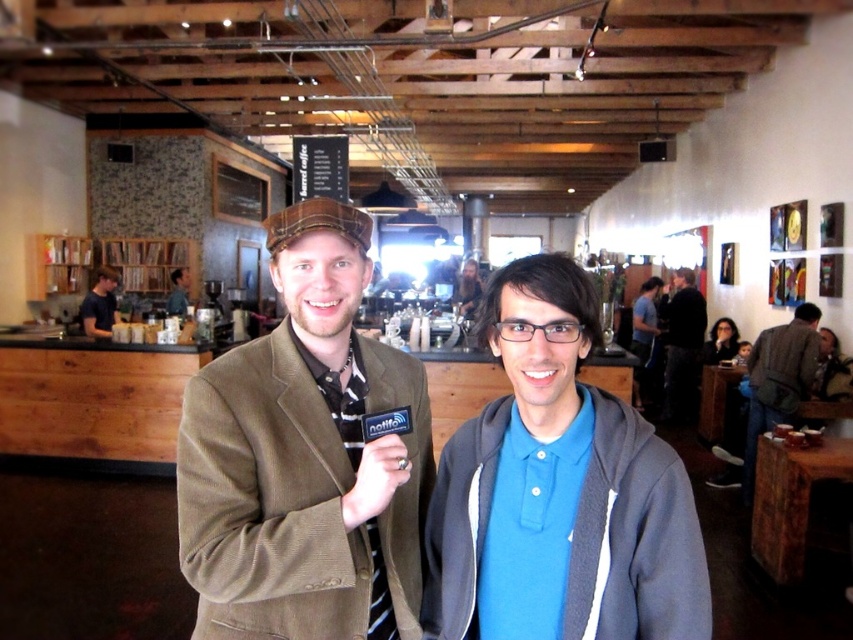
Does brown corduroy jacket at center appear on the right side of matte black hair at upper right?

Incorrect, brown corduroy jacket at center is not on the right side of matte black hair at upper right.

Which is below, brown corduroy jacket at center or matte black hair at upper right?

matte black hair at upper right is below.

Who is more forward, (234, 524) or (711, 358)?

Point (234, 524) is in front.

At what (x,y) coordinates should I click in order to perform the action: click on brown corduroy jacket at center. Please return your answer as a coordinate pair (x, y). The image size is (853, 640). Looking at the image, I should click on point(305,458).

Looking at this image, is blue cotton polo shirt at center smaller than dark blue shirt at left?

Actually, blue cotton polo shirt at center might be larger than dark blue shirt at left.

Measure the distance between blue cotton polo shirt at center and dark blue shirt at left.

blue cotton polo shirt at center is 6.22 meters from dark blue shirt at left.

The height and width of the screenshot is (640, 853). Describe the element at coordinates (558, 492) in the screenshot. I see `blue cotton polo shirt at center` at that location.

Identify the location of blue cotton polo shirt at center. (558, 492).

Can you confirm if brown leather backpack at right is taller than black leather jacket at center?

No.

Who is higher up, brown leather backpack at right or black leather jacket at center?

Positioned higher is black leather jacket at center.

This screenshot has width=853, height=640. Find the location of `brown leather backpack at right`. brown leather backpack at right is located at coordinates (778, 380).